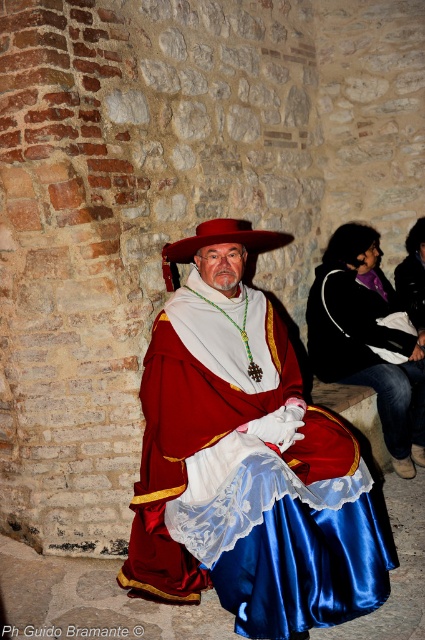
Question: Does satin dress at center appear on the right side of white satin robe at center?

Choices:
 (A) no
 (B) yes

Answer: (A)

Question: Which point is farther from the camera taking this photo?

Choices:
 (A) (345, 323)
 (B) (272, 451)

Answer: (A)

Question: Is the position of white satin robe at center less distant than that of matte red hat at center?

Choices:
 (A) no
 (B) yes

Answer: (A)

Question: Is satin dress at center to the left of white satin robe at center from the viewer's perspective?

Choices:
 (A) no
 (B) yes

Answer: (B)

Question: Estimate the real-world distances between objects in this image. Which object is closer to the satin dress at center?

Choices:
 (A) matte red hat at center
 (B) white satin robe at center

Answer: (A)

Question: Which object appears closest to the camera in this image?

Choices:
 (A) satin dress at center
 (B) matte red hat at center

Answer: (A)